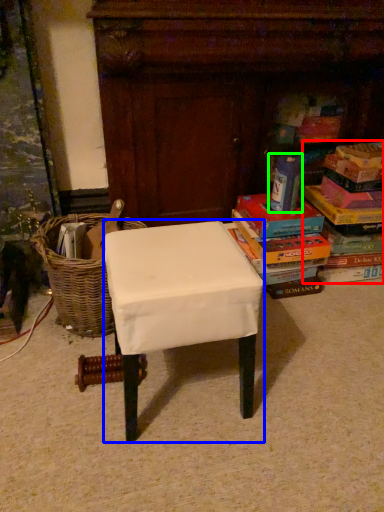
Question: Which object is the closest to the book (highlighted by a red box)? Choose among these: stool (highlighted by a blue box) or paperback book (highlighted by a green box).

Choices:
 (A) stool
 (B) paperback book

Answer: (B)